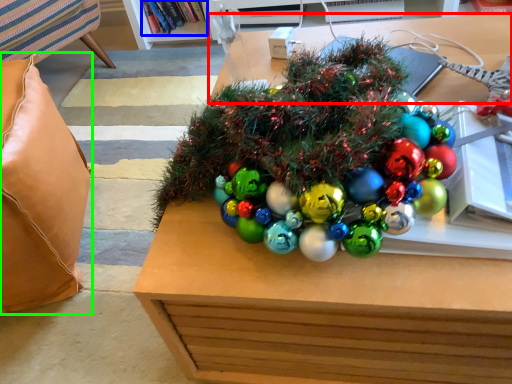
Question: Which is farther away from table (highlighted by a red box)? book (highlighted by a blue box) or pillow (highlighted by a green box)?

Choices:
 (A) book
 (B) pillow

Answer: (A)